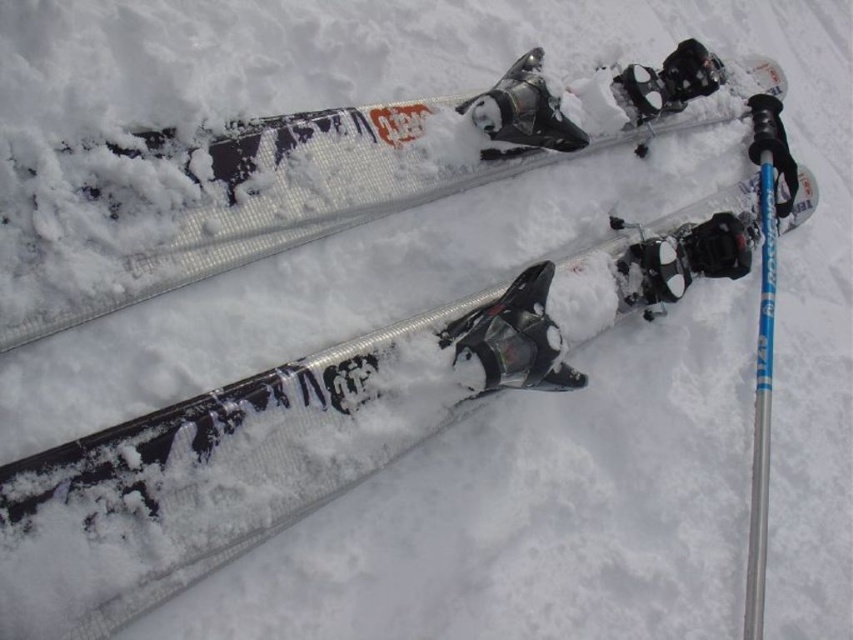
Question: Can you confirm if silver metallic skis at center is thinner than blue metallic pole at right?

Choices:
 (A) no
 (B) yes

Answer: (A)

Question: Considering the relative positions of silver metallic skis at center and blue metallic pole at right in the image provided, where is silver metallic skis at center located with respect to blue metallic pole at right?

Choices:
 (A) below
 (B) above

Answer: (B)

Question: Among these points, which one is nearest to the camera?

Choices:
 (A) coord(224,147)
 (B) coord(770,118)

Answer: (A)

Question: Does silver metallic skis at center lie behind blue metallic pole at right?

Choices:
 (A) no
 (B) yes

Answer: (A)